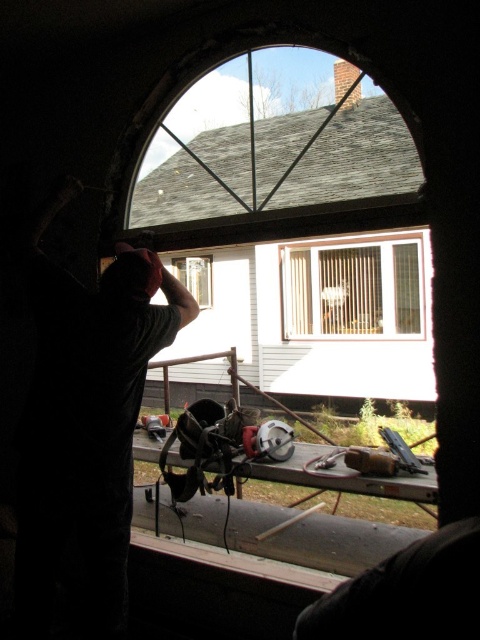
Who is positioned more to the right, dark gray t-shirt at left or clear glass window at center?

Positioned to the right is clear glass window at center.

Is dark gray t-shirt at left thinner than clear glass window at center?

Yes.

Who is more distant from viewer, (104, 596) or (207, 296)?

The point (207, 296) is more distant.

Where is `dark gray t-shirt at left`? This screenshot has width=480, height=640. dark gray t-shirt at left is located at coordinates (85, 420).

Looking at this image, between dark gray t-shirt at left and white textured window at center, which one has more height?

Standing taller between the two is dark gray t-shirt at left.

Measure the distance from dark gray t-shirt at left to white textured window at center.

dark gray t-shirt at left and white textured window at center are 21.11 feet apart from each other.

Is point (111, 381) positioned before point (304, 308)?

Yes, point (111, 381) is in front of point (304, 308).

I want to click on dark gray t-shirt at left, so click(85, 420).

Can you confirm if white textured window at center is positioned to the right of clear glass window at center?

Yes, white textured window at center is to the right of clear glass window at center.

The height and width of the screenshot is (640, 480). Identify the location of white textured window at center. (351, 289).